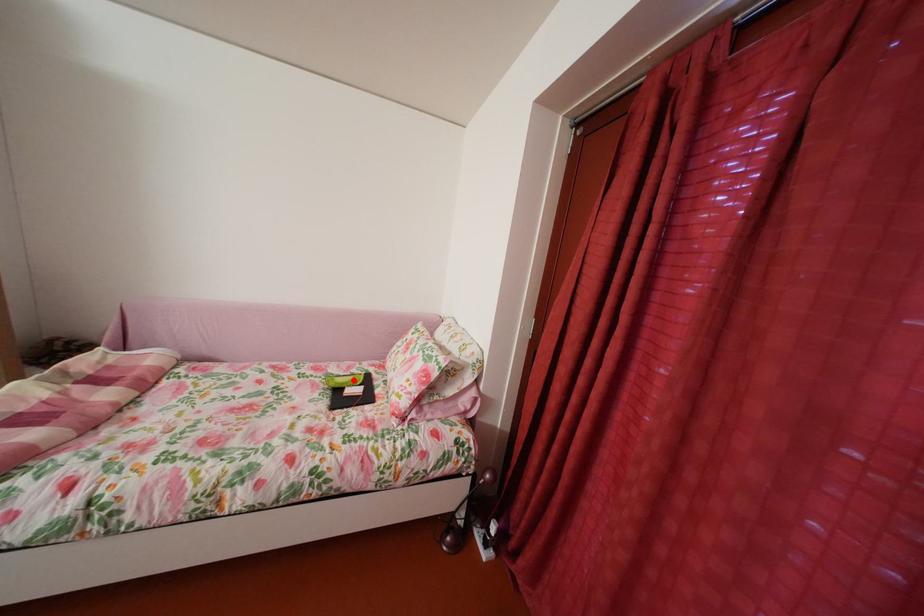
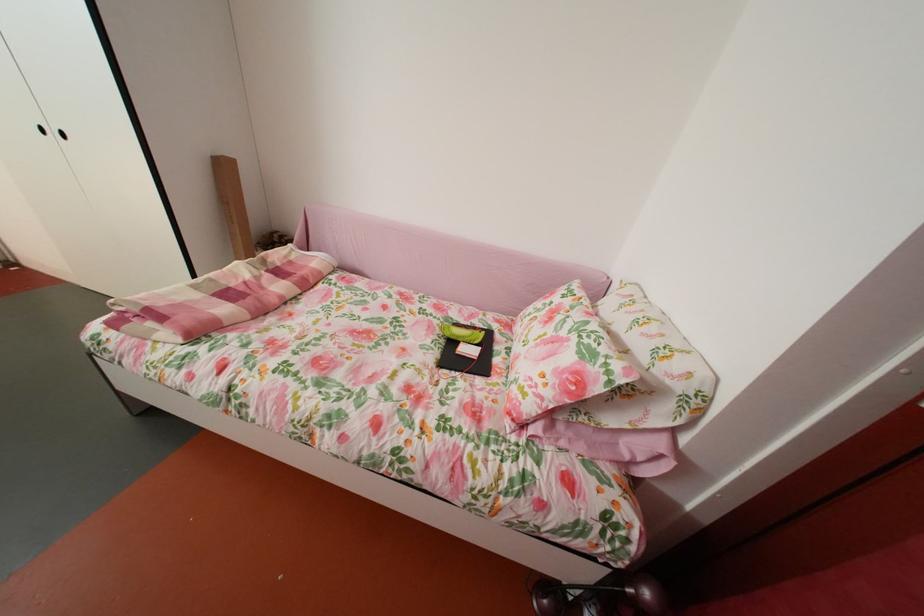
Locate, in the second image, the point that corresponds to the highlighted location in the first image.

(473, 328)